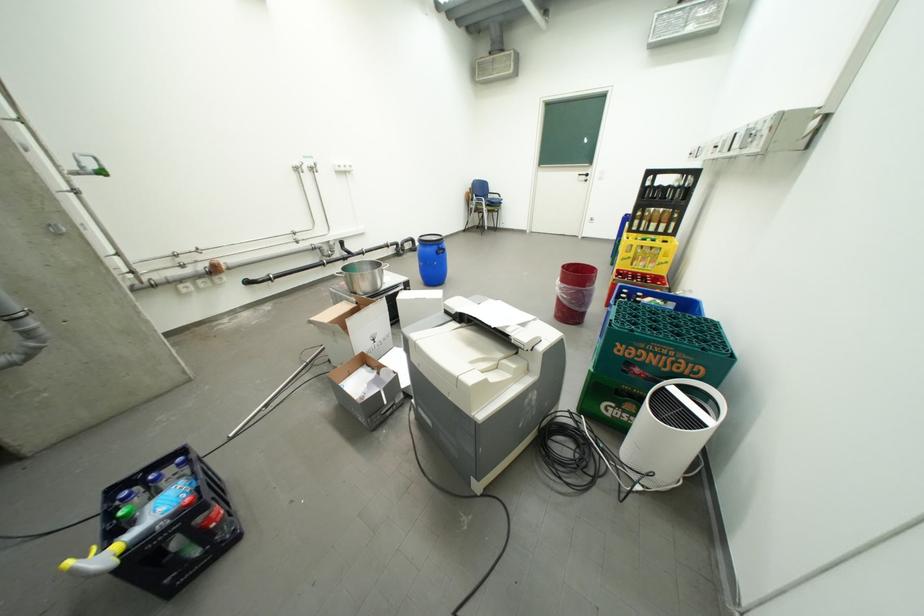
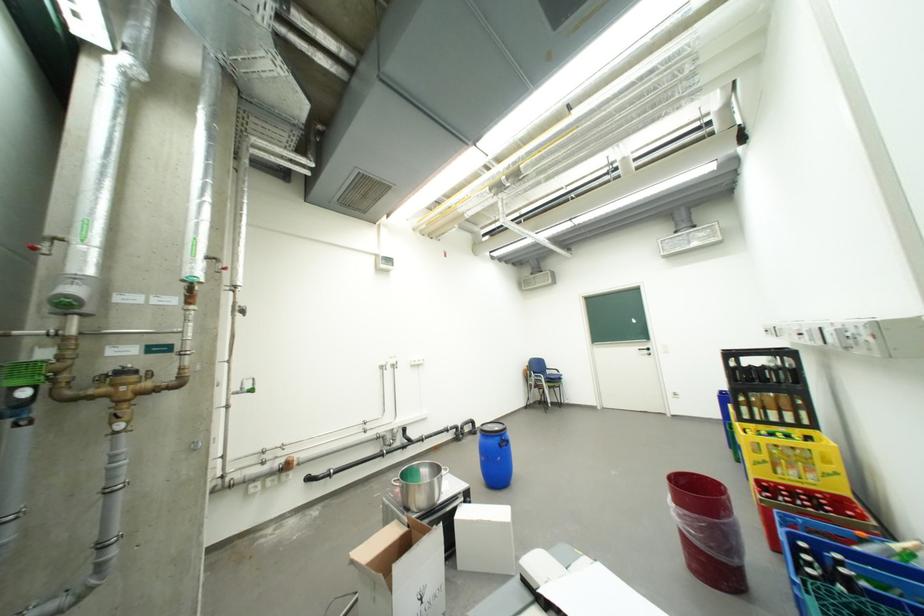
Locate, in the second image, the point that corresponds to point (590, 176) in the first image.

(650, 351)